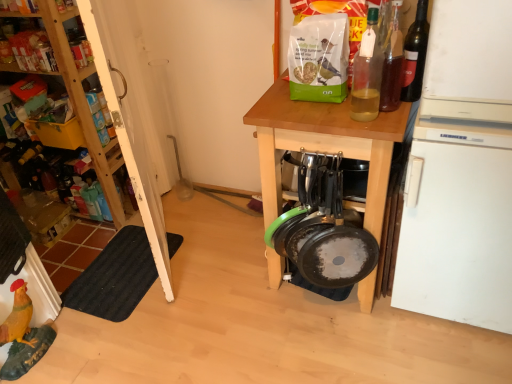
Image resolution: width=512 pixels, height=384 pixels. I want to click on vacant space that's between wooden table at center and black rubber mat at lower left, so click(217, 282).